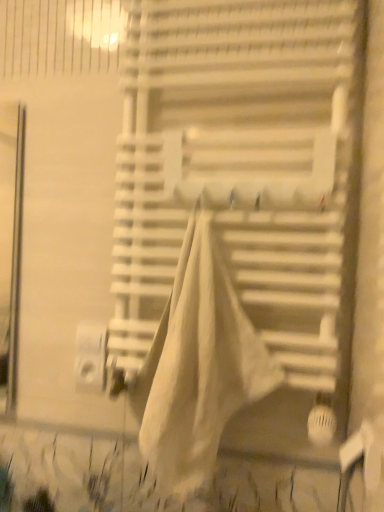
What are the coordinates of `white plastic window blind at center` in the screenshot? It's located at (x=243, y=170).

Describe the element at coordinates (243, 170) in the screenshot. I see `white plastic window blind at center` at that location.

From the picture: Measure the distance between point (263, 33) and camera.

The distance of point (263, 33) from camera is 37.20 inches.

What do you see at coordinates (198, 366) in the screenshot? I see `white cotton blanket at center` at bounding box center [198, 366].

Image resolution: width=384 pixels, height=512 pixels. In order to click on white cotton blanket at center in this screenshot , I will do `click(198, 366)`.

Identify the location of white plastic window blind at center. This screenshot has width=384, height=512. (243, 170).

Considering the relative positions of white cotton blanket at center and white plastic window blind at center in the image provided, is white cotton blanket at center to the right of white plastic window blind at center from the viewer's perspective?

Incorrect, white cotton blanket at center is not on the right side of white plastic window blind at center.

In the image, is white cotton blanket at center positioned in front of or behind white plastic window blind at center?

Visually, white cotton blanket at center is located in front of white plastic window blind at center.

Which is closer, [196,303] or [278,82]?

The point [196,303] is more forward.

From the image's perspective, is white cotton blanket at center below white plastic window blind at center?

Yes, from the image's perspective, white cotton blanket at center is beneath white plastic window blind at center.

From a real-world perspective, is white cotton blanket at center above or below white plastic window blind at center?

Clearly, from a real-world perspective, white cotton blanket at center is below white plastic window blind at center.

Looking at their sizes, would you say white cotton blanket at center is wider or thinner than white plastic window blind at center?

Considering their sizes, white cotton blanket at center looks broader than white plastic window blind at center.

In terms of height, does white cotton blanket at center look taller or shorter compared to white plastic window blind at center?

white cotton blanket at center is shorter than white plastic window blind at center.

Which of these two, white cotton blanket at center or white plastic window blind at center, is smaller?

With smaller size is white cotton blanket at center.

Does white cotton blanket at center contain white plastic window blind at center?

Actually, white plastic window blind at center is outside white cotton blanket at center.

Would you consider white cotton blanket at center to be distant from white plastic window blind at center?

No, white cotton blanket at center is in close proximity to white plastic window blind at center.

Is white cotton blanket at center looking in the opposite direction of white plastic window blind at center?

Yes, white cotton blanket at center is positioned with its back facing white plastic window blind at center.

Can you tell me how much white cotton blanket at center and white plastic window blind at center differ in facing direction?

0.00173 degrees.

How distant is white cotton blanket at center from white plastic window blind at center?

They are 6.98 inches apart.

Image resolution: width=384 pixels, height=512 pixels. I want to click on window blind on the right side of white cotton blanket at center, so click(243, 170).

Based on the photo, is white plastic window blind at center to the left of white cotton blanket at center from the viewer's perspective?

No.

Between white plastic window blind at center and white cotton blanket at center, which one is positioned in front?

white cotton blanket at center.

Considering the points (319, 60) and (184, 456), which point is behind, point (319, 60) or point (184, 456)?

The point (319, 60) is farther.

From the image's perspective, who appears lower, white plastic window blind at center or white cotton blanket at center?

white cotton blanket at center appears lower in the image.

From a real-world perspective, who is located higher, white plastic window blind at center or white cotton blanket at center?

white plastic window blind at center, from a real-world perspective.

Considering the sizes of objects white plastic window blind at center and white cotton blanket at center in the image provided, who is wider, white plastic window blind at center or white cotton blanket at center?

white cotton blanket at center is wider.

Can you confirm if white plastic window blind at center is shorter than white cotton blanket at center?

No.

Does white plastic window blind at center have a smaller size compared to white cotton blanket at center?

Actually, white plastic window blind at center might be larger than white cotton blanket at center.

Would you say white plastic window blind at center is outside white cotton blanket at center?

Indeed, white plastic window blind at center is completely outside white cotton blanket at center.

Is white plastic window blind at center not near white cotton blanket at center?

No, white plastic window blind at center is not far away from white cotton blanket at center.

Does white plastic window blind at center turn towards white cotton blanket at center?

Yes, white plastic window blind at center is oriented towards white cotton blanket at center.

How different are the orientations of white plastic window blind at center and white cotton blanket at center in degrees?

white plastic window blind at center and white cotton blanket at center are facing 0.00173 degrees away from each other.

Measure the distance between white plastic window blind at center and white cotton blanket at center.

They are 6.98 inches apart.

Locate an element on the screen. This screenshot has width=384, height=512. window blind that is behind the white cotton blanket at center is located at coordinates (243, 170).

What are the coordinates of `blanket below the white plastic window blind at center (from the image's perspective)` in the screenshot? It's located at (198, 366).

Locate an element on the screen. window blind on the right of the white cotton blanket at center is located at coordinates (243, 170).